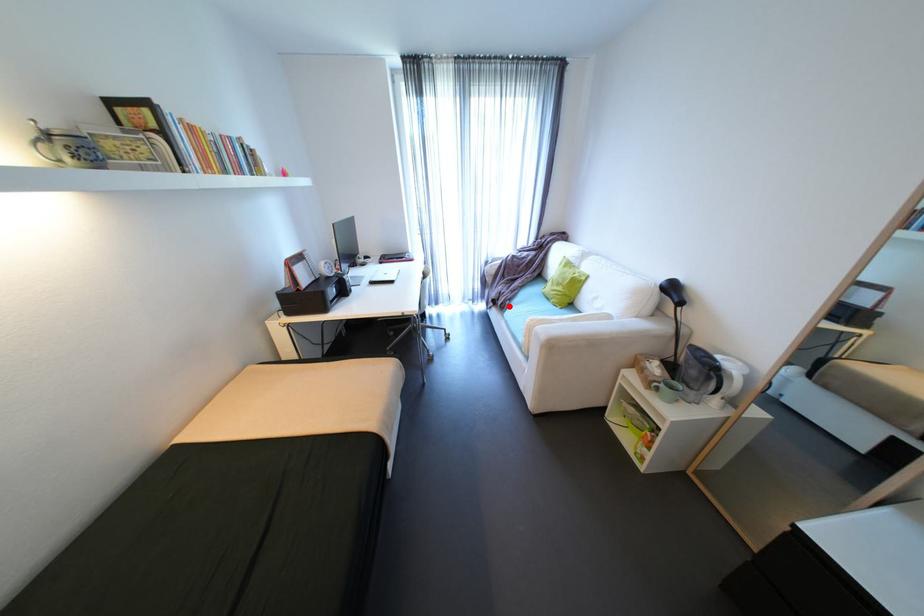
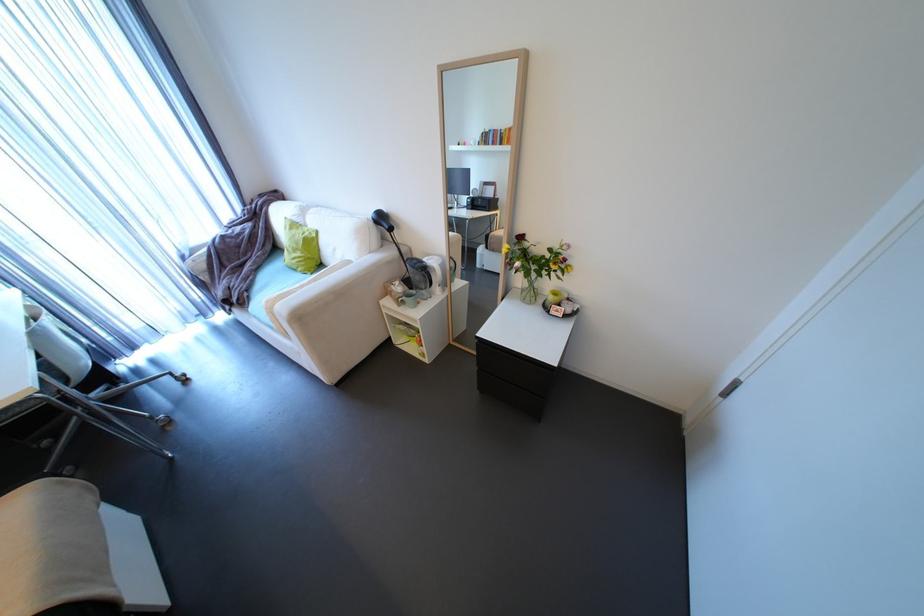
Question: A red point is marked in image1. In image2, is the corresponding 3D point closer to the camera or farther? Reply with the corresponding letter.

Choices:
 (A) The corresponding 3D point is closer.
 (B) The corresponding 3D point is farther.

Answer: (B)